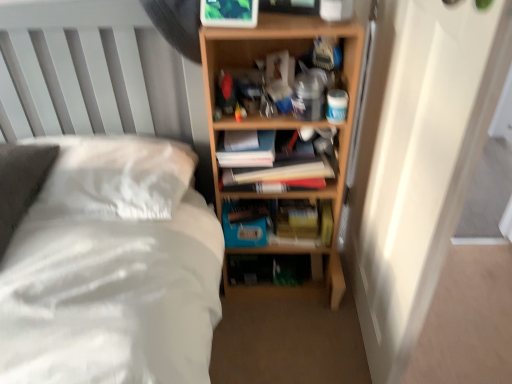
In order to click on white soft bed at center in this screenshot , I will do `click(112, 269)`.

The width and height of the screenshot is (512, 384). Find the location of `blue matte paperback book at center`. blue matte paperback book at center is located at coordinates (244, 223).

In order to face blue matte paperback book at center, should I rotate leftwards or rightwards?

Turn left approximately 1.437 degrees to face it.

Where is `hardcover books at center`? The height and width of the screenshot is (384, 512). hardcover books at center is located at coordinates (283, 165).

Is blue matte paperback book at center positioned behind wooden bookshelf at center?

Yes, blue matte paperback book at center is further from the viewer.

From the image's perspective, is blue matte paperback book at center on wooden bookshelf at center?

Actually, blue matte paperback book at center appears below wooden bookshelf at center in the image.

Does blue matte paperback book at center have a larger size compared to wooden bookshelf at center?

No, blue matte paperback book at center is not bigger than wooden bookshelf at center.

Is blue matte paperback book at center far from wooden bookshelf at center?

No.

Can you confirm if hardcover books at center is shorter than blue matte paperback book at center?

In fact, hardcover books at center may be taller than blue matte paperback book at center.

Is hardcover books at center looking in the opposite direction of blue matte paperback book at center?

No, hardcover books at center is not facing the opposite direction of blue matte paperback book at center.

Is hardcover books at center smaller than blue matte paperback book at center?

No.

From a real-world perspective, which object rests below the other?

In real-world perspective, blue matte paperback book at center is lower.

Can you confirm if white soft bed at center is smaller than blue matte paperback book at center?

Incorrect, white soft bed at center is not smaller in size than blue matte paperback book at center.

Considering the positions of objects white soft bed at center and blue matte paperback book at center in the image provided, who is more to the left, white soft bed at center or blue matte paperback book at center?

white soft bed at center.

Can we say white soft bed at center lies outside blue matte paperback book at center?

Yes, white soft bed at center is outside of blue matte paperback book at center.

Consider the image. How different are the orientations of white soft bed at center and blue matte paperback book at center in degrees?

0.668 degrees separate the facing orientations of white soft bed at center and blue matte paperback book at center.

From a real-world perspective, is blue matte paperback book at center positioned over hardcover books at center based on gravity?

No, from a real-world perspective, blue matte paperback book at center is not over hardcover books at center

Visually, is blue matte paperback book at center positioned to the left or to the right of hardcover books at center?

Clearly, blue matte paperback book at center is on the left of hardcover books at center in the image.

Considering the positions of points (264, 224) and (243, 169), is point (264, 224) farther from camera compared to point (243, 169)?

Yes, it is behind point (243, 169).

Can you confirm if blue matte paperback book at center is wider than hardcover books at center?

In fact, blue matte paperback book at center might be narrower than hardcover books at center.

This screenshot has width=512, height=384. What are the coordinates of `bed lying below the hardcover books at center (from the image's perspective)` in the screenshot? It's located at (112, 269).

Can you confirm if white soft bed at center is wider than hardcover books at center?

Indeed, white soft bed at center has a greater width compared to hardcover books at center.

From a real-world perspective, does white soft bed at center stand above hardcover books at center?

No, from a real-world perspective, white soft bed at center is not on top of hardcover books at center.

Which is less distant, (35, 305) or (272, 136)?

The point (35, 305) is closer to the camera.

Is white soft bed at center positioned far away from wooden bookshelf at center?

No, white soft bed at center is not far away from wooden bookshelf at center.

Does white soft bed at center come in front of wooden bookshelf at center?

Yes, it is.

Is white soft bed at center oriented away from wooden bookshelf at center?

No, white soft bed at center is not facing the opposite direction of wooden bookshelf at center.

Can you tell me how much white soft bed at center and wooden bookshelf at center differ in facing direction?

There is a 1.25-degree angle between the facing directions of white soft bed at center and wooden bookshelf at center.

From a real-world perspective, is hardcover books at center positioned under white soft bed at center based on gravity?

Incorrect, from a real-world perspective, hardcover books at center is higher than white soft bed at center.

Identify the location of book above the white soft bed at center (from the image's perspective). (283, 165).

Consider the image. Between hardcover books at center and white soft bed at center, which one has larger size?

Bigger between the two is white soft bed at center.

Would you say hardcover books at center contains white soft bed at center?

No, white soft bed at center is not a part of hardcover books at center.

This screenshot has height=384, width=512. I want to click on paperback book on the left of wooden bookshelf at center, so click(x=244, y=223).

This screenshot has width=512, height=384. In order to click on paperback book behind the hardcover books at center in this screenshot , I will do `click(244, 223)`.

Based on their spatial positions, is white soft bed at center or blue matte paperback book at center further from wooden bookshelf at center?

The object further to wooden bookshelf at center is white soft bed at center.

Based on their spatial positions, is blue matte paperback book at center or white soft bed at center closer to wooden bookshelf at center?

blue matte paperback book at center lies closer to wooden bookshelf at center than the other object.

Looking at the image, which one is located further to wooden bookshelf at center, white soft bed at center or hardcover books at center?

Among the two, white soft bed at center is located further to wooden bookshelf at center.

When comparing their distances from white soft bed at center, does wooden bookshelf at center or blue matte paperback book at center seem closer?

Based on the image, blue matte paperback book at center appears to be nearer to white soft bed at center.

When comparing their distances from hardcover books at center, does wooden bookshelf at center or white soft bed at center seem closer?

wooden bookshelf at center is closer to hardcover books at center.

Which object lies nearer to the anchor point blue matte paperback book at center, wooden bookshelf at center or white soft bed at center?

wooden bookshelf at center is closer to blue matte paperback book at center.

Based on their spatial positions, is white soft bed at center or blue matte paperback book at center further from hardcover books at center?

white soft bed at center.

Which object lies nearer to the anchor point white soft bed at center, hardcover books at center or blue matte paperback book at center?

hardcover books at center.

Locate an element on the screen. The width and height of the screenshot is (512, 384). book between wooden bookshelf at center and blue matte paperback book at center from front to back is located at coordinates (283, 165).

This screenshot has width=512, height=384. I want to click on shelf located between white soft bed at center and hardcover books at center in the depth direction, so click(x=284, y=128).

Locate an element on the screen. This screenshot has height=384, width=512. shelf between white soft bed at center and blue matte paperback book at center along the z-axis is located at coordinates point(284,128).

Find the location of a particular element. This screenshot has height=384, width=512. book between white soft bed at center and blue matte paperback book at center from front to back is located at coordinates (283, 165).